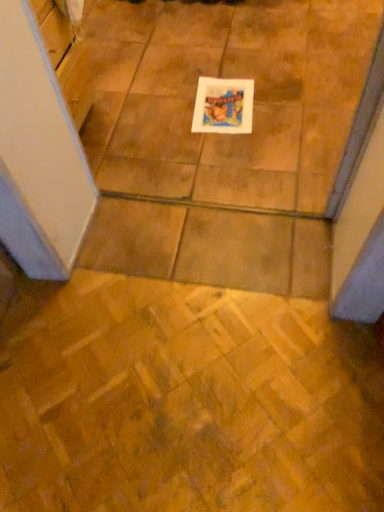
The height and width of the screenshot is (512, 384). In order to click on white paper at center in this screenshot , I will do `click(223, 106)`.

The width and height of the screenshot is (384, 512). What do you see at coordinates (223, 106) in the screenshot?
I see `white paper at center` at bounding box center [223, 106].

In order to face wooden parquet floor at center, should I rotate leftwards or rightwards?

Rotate your view left by about 4.355°.

What is the approximate width of wooden parquet floor at center?

It is 23.84 inches.

Describe the element at coordinates (185, 401) in the screenshot. I see `wooden parquet floor at center` at that location.

Locate an element on the screen. The image size is (384, 512). wooden parquet floor at center is located at coordinates coord(185,401).

Identify the location of white paper at center. Image resolution: width=384 pixels, height=512 pixels. (223, 106).

Based on their positions, is white paper at center located to the left or right of wooden parquet floor at center?

In the image, white paper at center appears on the right side of wooden parquet floor at center.

Relative to wooden parquet floor at center, is white paper at center in front or behind?

white paper at center is positioned farther from the viewer than wooden parquet floor at center.

Between point (201, 113) and point (99, 432), which one is positioned in front?

The point (99, 432) is closer.

From the image's perspective, which is above, white paper at center or wooden parquet floor at center?

white paper at center.

Looking at this image, from a real-world perspective, is white paper at center on top of wooden parquet floor at center?

No.

Considering the relative sizes of white paper at center and wooden parquet floor at center in the image provided, is white paper at center wider than wooden parquet floor at center?

In fact, white paper at center might be narrower than wooden parquet floor at center.

From their relative heights in the image, would you say white paper at center is taller or shorter than wooden parquet floor at center?

white paper at center is shorter than wooden parquet floor at center.

Looking at this image, considering the relative sizes of white paper at center and wooden parquet floor at center in the image provided, is white paper at center smaller than wooden parquet floor at center?

Indeed, white paper at center has a smaller size compared to wooden parquet floor at center.

Is wooden parquet floor at center completely or partially inside white paper at center?

No.

Are white paper at center and wooden parquet floor at center beside each other?

white paper at center and wooden parquet floor at center are not in contact.

Is white paper at center turned away from wooden parquet floor at center?

Yes, white paper at center's orientation is away from wooden parquet floor at center.

Find the location of a particular element. The image size is (384, 512). ceramic tile located above the white paper at center (from a real-world perspective) is located at coordinates (185, 401).

Is wooden parquet floor at center at the right side of white paper at center?

No, wooden parquet floor at center is not to the right of white paper at center.

Looking at this image, considering the relative positions of wooden parquet floor at center and white paper at center in the image provided, is wooden parquet floor at center behind white paper at center?

No, it is not.

Is point (225, 474) farther from camera compared to point (242, 131)?

No, it is in front of (242, 131).

From the image's perspective, is wooden parquet floor at center located beneath white paper at center?

Yes.

From a real-world perspective, does wooden parquet floor at center stand above white paper at center?

Indeed, from a real-world perspective, wooden parquet floor at center stands above white paper at center.

Considering the sizes of objects wooden parquet floor at center and white paper at center in the image provided, who is thinner, wooden parquet floor at center or white paper at center?

white paper at center.

Does wooden parquet floor at center have a lesser height compared to white paper at center?

No, wooden parquet floor at center is not shorter than white paper at center.

Who is smaller, wooden parquet floor at center or white paper at center?

Smaller between the two is white paper at center.

Would you say wooden parquet floor at center is outside white paper at center?

Absolutely, wooden parquet floor at center is external to white paper at center.

Is wooden parquet floor at center placed right next to white paper at center?

They are not placed beside each other.

Could you tell me if wooden parquet floor at center is turned towards white paper at center?

Yes, wooden parquet floor at center faces towards white paper at center.

Can you tell me how much wooden parquet floor at center and white paper at center differ in facing direction?

3.85 degrees separate the facing orientations of wooden parquet floor at center and white paper at center.

Locate an element on the screen. This screenshot has height=512, width=384. ceramic tile on the left of white paper at center is located at coordinates (185, 401).

Locate an element on the screen. picture frame that appears below the wooden parquet floor at center (from a real-world perspective) is located at coordinates (223, 106).

This screenshot has width=384, height=512. What are the coordinates of `picture frame behind the wooden parquet floor at center` in the screenshot? It's located at (223, 106).